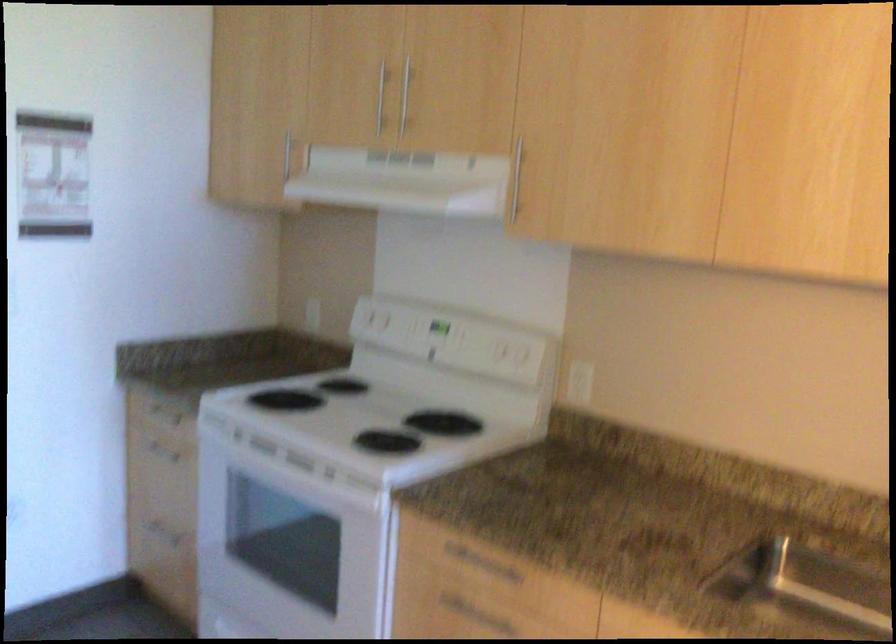
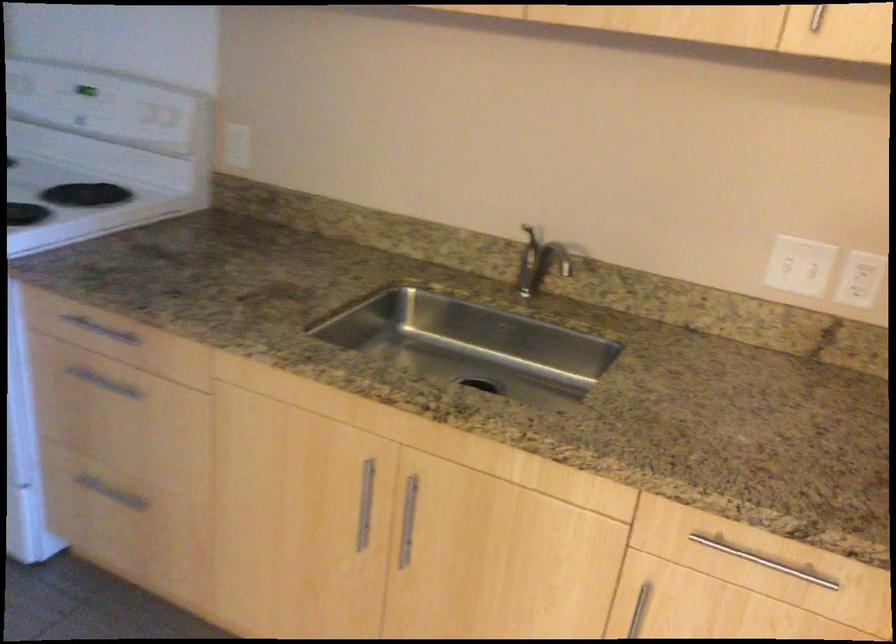
Locate, in the second image, the point that corresponds to point 437,319 in the first image.

(85, 90)